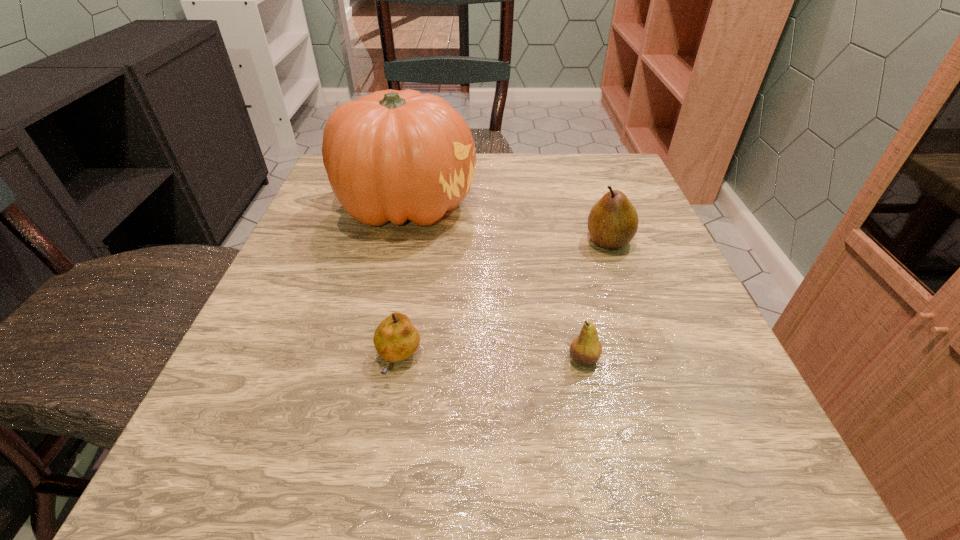
Image resolution: width=960 pixels, height=540 pixels. In order to click on pumpkin in this screenshot , I will do `click(392, 155)`.

Identify the location of the rightmost object. (613, 221).

Image resolution: width=960 pixels, height=540 pixels. Identify the location of the second tallest object. (613, 221).

Identify the location of the second object from right to left. (586, 348).

At what (x,y) coordinates should I click in order to perform the action: click on the shortest pear. Please return your answer as a coordinate pair (x, y). Looking at the image, I should click on (395, 339).

Identify the location of the shortest object. (395, 339).

Where is `vacant space situated 0.110m on the carved face of the tallest object`? The image size is (960, 540). vacant space situated 0.110m on the carved face of the tallest object is located at coordinates (528, 205).

I want to click on vacant space located 0.170m on the back of the rightmost object, so click(588, 183).

Identify the location of free space located 0.110m on the left of the second pear from left to right. (492, 359).

The height and width of the screenshot is (540, 960). Find the location of `vacant region located on the right of the shortest pear`. vacant region located on the right of the shortest pear is located at coordinates (641, 360).